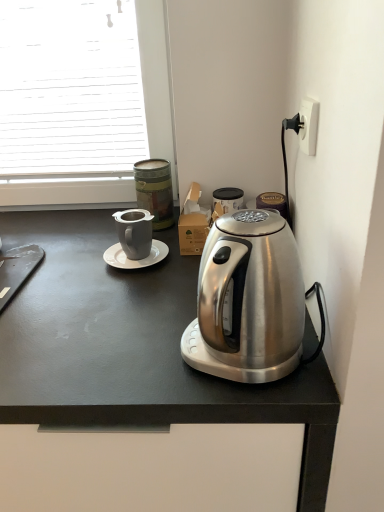
Question: Would you say white plastic power outlet at upper right contains satin silver kettle at right?

Choices:
 (A) no
 (B) yes

Answer: (A)

Question: Does white plastic power outlet at upper right appear on the right side of satin silver kettle at right?

Choices:
 (A) yes
 (B) no

Answer: (A)

Question: Is white plastic power outlet at upper right next to satin silver kettle at right?

Choices:
 (A) no
 (B) yes

Answer: (A)

Question: Are white plastic power outlet at upper right and satin silver kettle at right far apart?

Choices:
 (A) no
 (B) yes

Answer: (A)

Question: Can you confirm if white plastic power outlet at upper right is positioned to the left of satin silver kettle at right?

Choices:
 (A) no
 (B) yes

Answer: (A)

Question: In terms of width, does white glossy saucer at center look wider or thinner when compared to matte gray mug at upper center?

Choices:
 (A) wide
 (B) thin

Answer: (B)

Question: Is white glossy saucer at center bigger or smaller than matte gray mug at upper center?

Choices:
 (A) big
 (B) small

Answer: (B)

Question: From the image's perspective, is white glossy saucer at center positioned above or below matte gray mug at upper center?

Choices:
 (A) below
 (B) above

Answer: (A)

Question: Considering the positions of white glossy saucer at center and matte gray mug at upper center in the image, is white glossy saucer at center taller or shorter than matte gray mug at upper center?

Choices:
 (A) tall
 (B) short

Answer: (B)

Question: Is white glossy saucer at center bigger or smaller than satin silver kettle at right?

Choices:
 (A) small
 (B) big

Answer: (A)

Question: Considering the positions of white glossy saucer at center and satin silver kettle at right in the image, is white glossy saucer at center taller or shorter than satin silver kettle at right?

Choices:
 (A) tall
 (B) short

Answer: (B)

Question: Choose the correct answer: Is white glossy saucer at center inside satin silver kettle at right or outside it?

Choices:
 (A) inside
 (B) outside

Answer: (B)

Question: From the image's perspective, relative to satin silver kettle at right, is white glossy saucer at center above or below?

Choices:
 (A) below
 (B) above

Answer: (B)

Question: Is satin silver kettle at center taller or shorter than white glossy saucer at center?

Choices:
 (A) short
 (B) tall

Answer: (B)

Question: From a real-world perspective, is satin silver kettle at center above or below white glossy saucer at center?

Choices:
 (A) below
 (B) above

Answer: (A)